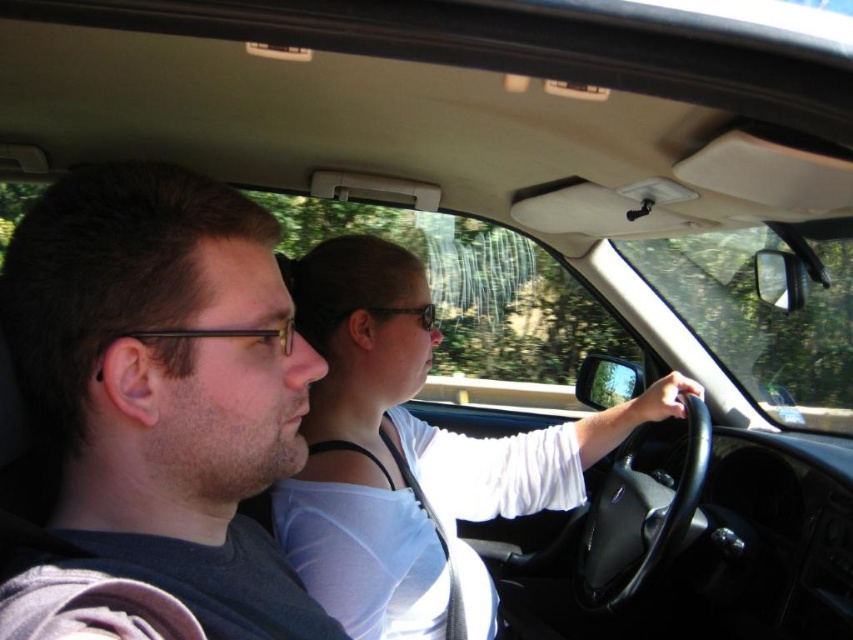
Is dark gray fabric shirt at left shorter than matte black shirt at center?

Indeed, dark gray fabric shirt at left has a lesser height compared to matte black shirt at center.

Does dark gray fabric shirt at left have a greater width compared to matte black shirt at center?

No.

Is point (143, 445) closer to viewer compared to point (480, 518)?

That is True.

The image size is (853, 640). In order to click on dark gray fabric shirt at left in this screenshot , I will do `click(157, 408)`.